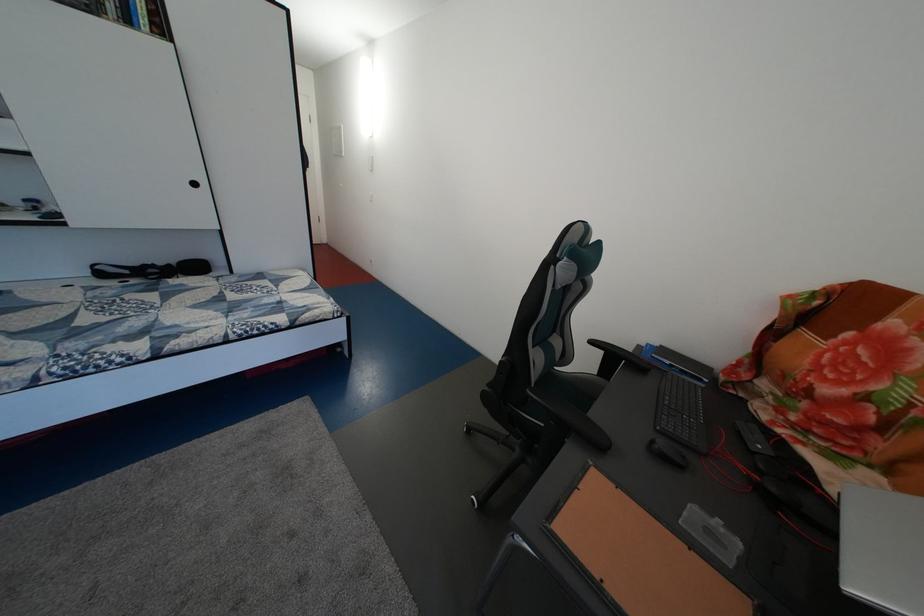
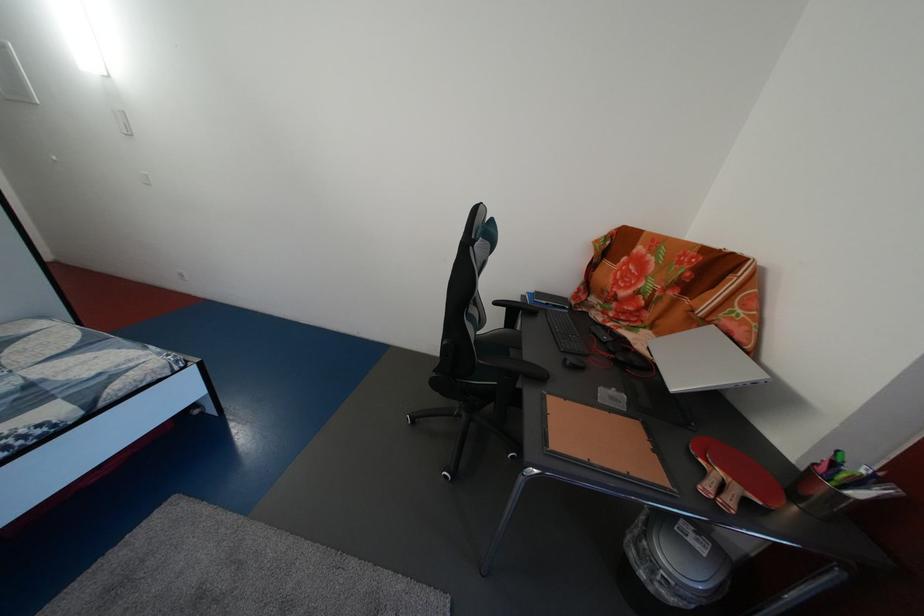
Where in the second image is the point corresponding to point 664,448 from the first image?

(576, 367)